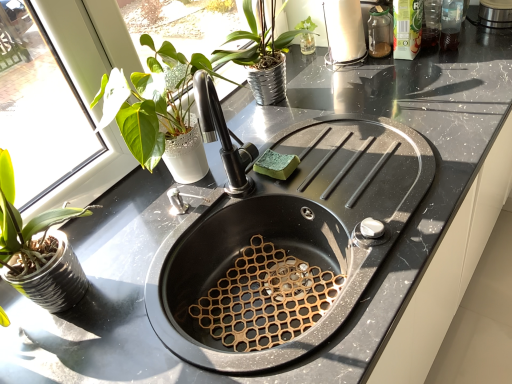
The height and width of the screenshot is (384, 512). Identify the location of free point behind green sponge at sink. (288, 130).